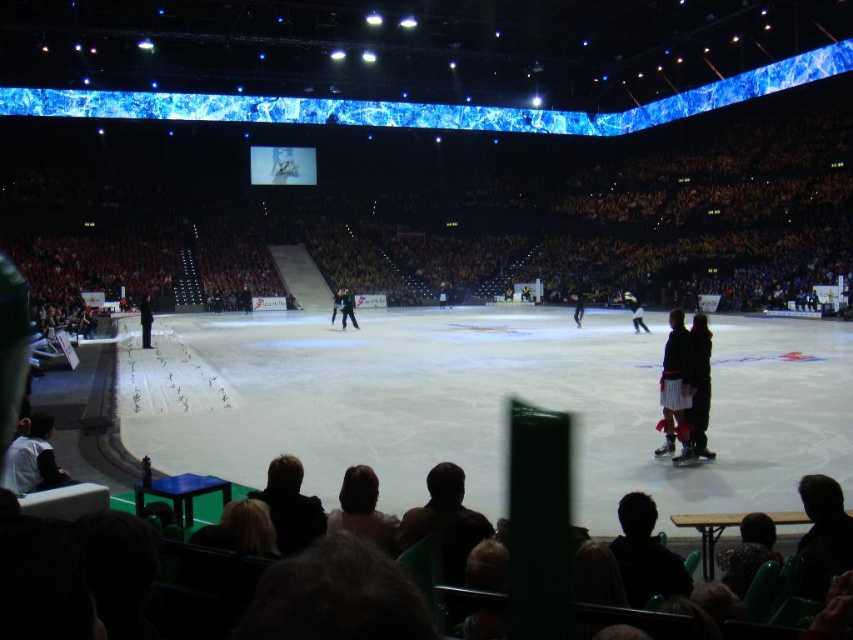
You are a photographer trying to capture a clear shot of the light blue fabric figure skater at center without the dark brown leather seats at lower center blocking the view. Given their sizes, is it possible to adjust your camera angle to avoid the seats?

The dark brown leather seats at lower center are larger than the light blue fabric figure skater at center. By angling the camera upwards or moving to a higher position, you can position the smaller figure skater above the seats, ensuring they are not obscured.

You are a photographer standing at the edge of the arena. You want to take a photo of the light blue fabric figure skater at center without the dark brown leather seats at lower center blocking the view. Is this possible?

The dark brown leather seats at lower center are located above the light blue fabric figure skater at center, so if you position yourself lower or adjust your angle to avoid the seats, you can capture the skater without obstruction.

You are a photographer standing at the edge of the ice rink. You want to capture a photo of the light blue fabric figure skater at center without the dark brown leather seats at lower center blocking the view. Is there enough space between the seats and the skater for you to take the photo?

The dark brown leather seats at lower center might be wider than the light blue fabric figure skater at center, so there may not be enough space to avoid the seats blocking the view. Adjust your position to ensure the skater is fully visible.